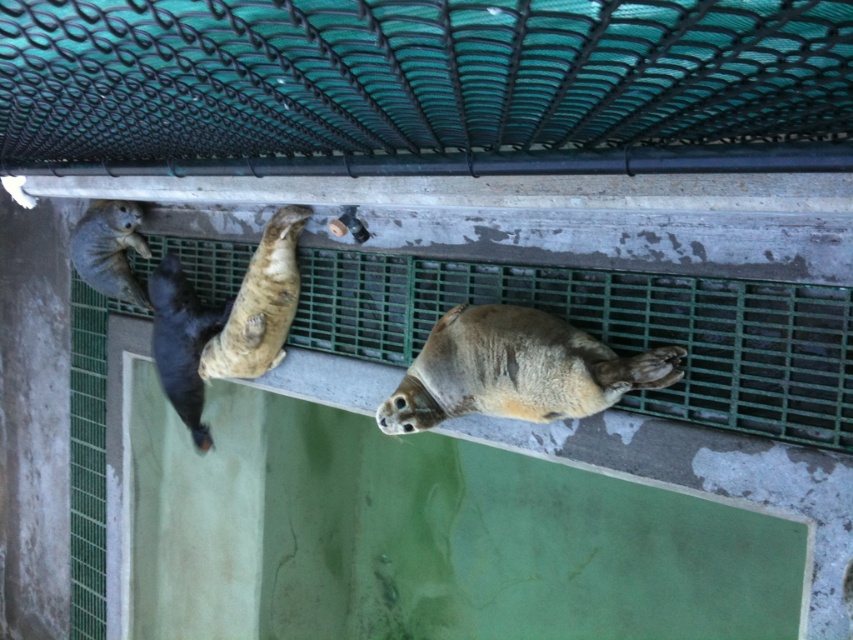
You are standing in front of the seal enclosure and notice two points marked on the grate. The first point is at coordinates point (253,278) and the second is at point (114,208). Which point is closer to you?

Point (253,278) is closer to the viewer than point (114,208).

You are a zookeeper observing the seals in their enclosure. You notice the black fur seal at lower left and the smooth gray seal at upper left. Which seal is taller?

The black fur seal at lower left is taller than the smooth gray seal at upper left.

You are a zookeeper observing the seals in their enclosure. You need to check the health of the light brown fur seal at center and the black fur seal at lower left. Which seal should you approach first if you want to check the one closer to the center of the enclosure?

The light brown fur seal at center is positioned on the right side of the black fur seal at lower left, so the light brown fur seal at center is closer to the center of the enclosure. You should approach the light brown fur seal at center first.